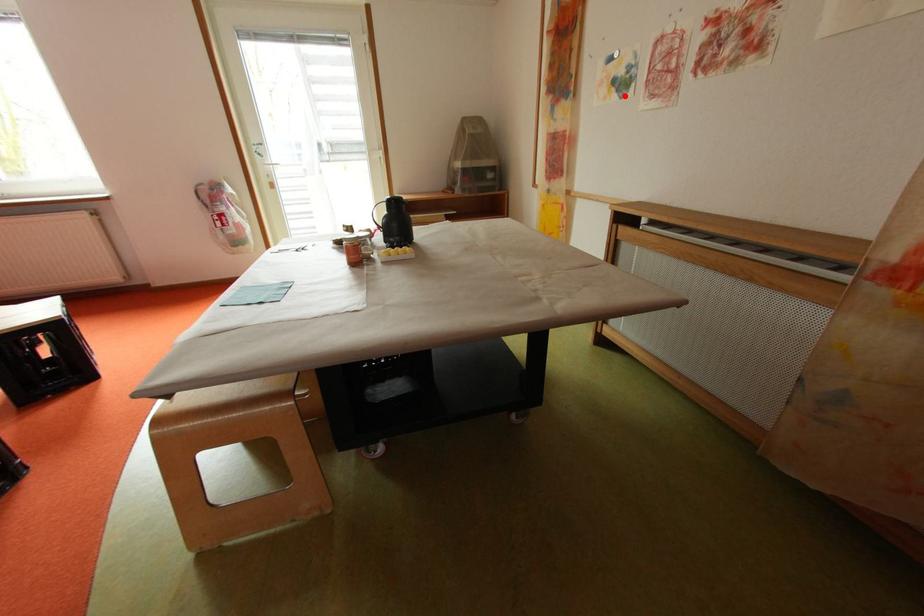
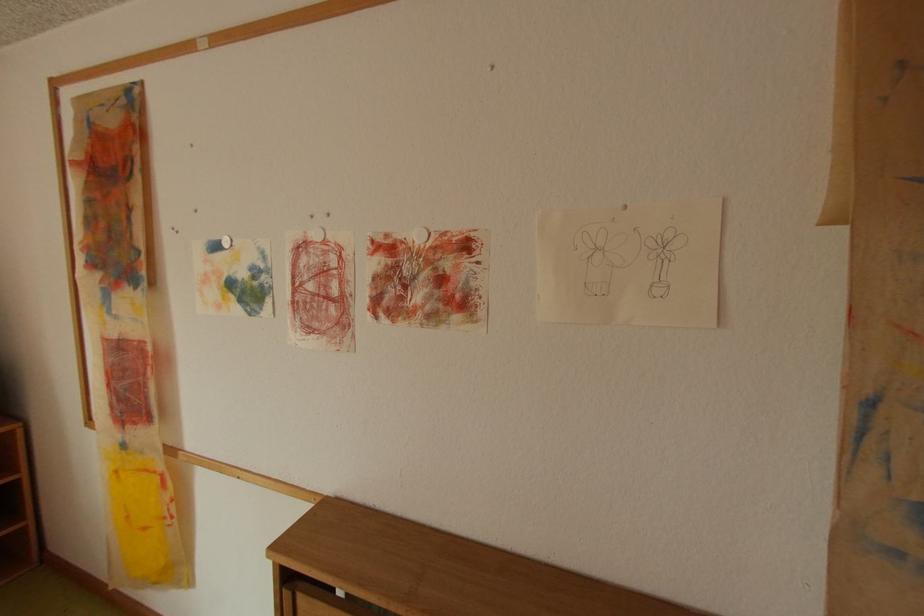
In the second image, find the point that corresponds to the highlighted location in the first image.

(247, 309)